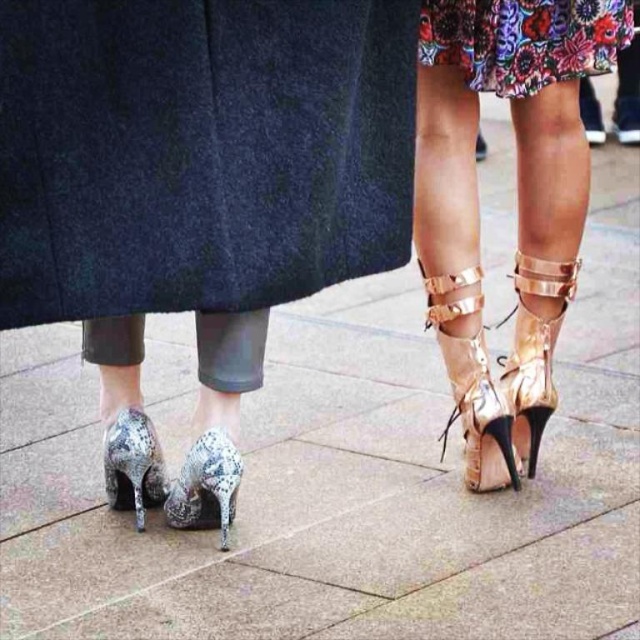
You are a photographer trying to capture the shiny metallic high heels at center in the image. The camera is set to focus on the point at coordinates point [198,170]. Will the shiny metallic high heels at center be in focus?

The shiny metallic high heels at center is located at point [198,170], so yes, the camera will focus on the shiny metallic high heels at center at that point.

Based on the photo, you are standing in front of two people whose legs are shown in the image. You need to determine which of the two points, point [216,452] or point [108,456], is closer to you. Which one is it?

Point [216,452] is closer to the viewer than point [108,456].